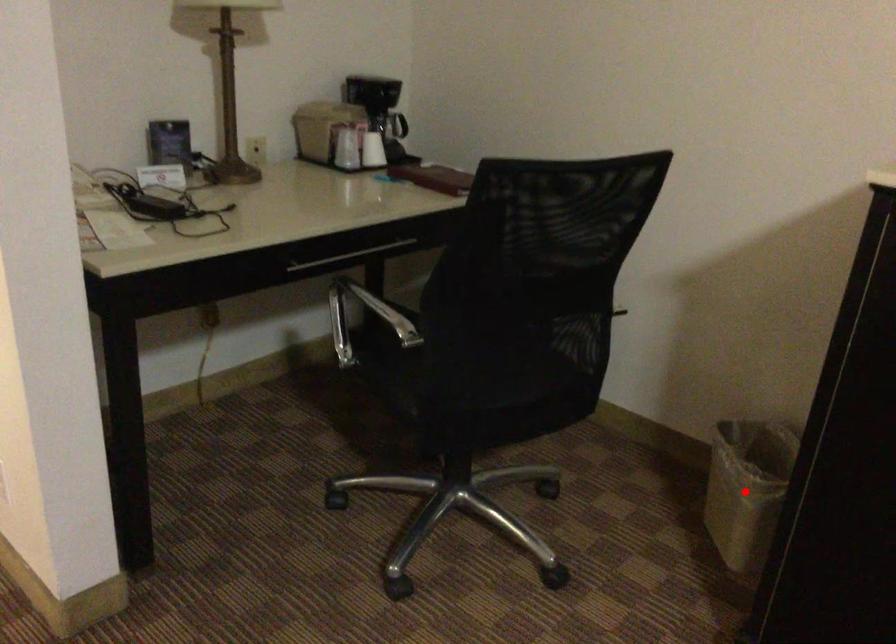
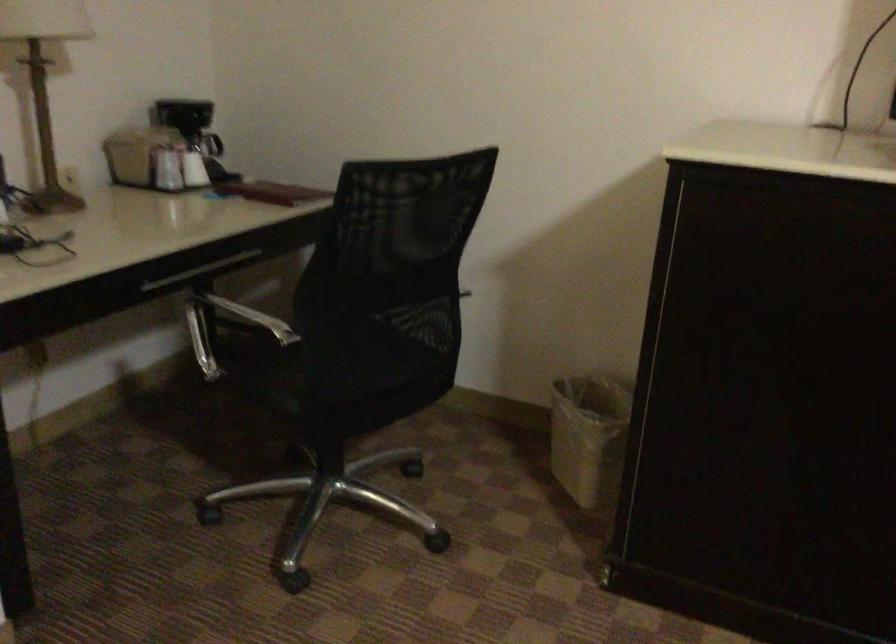
Question: I am providing you with two images of the same scene from different viewpoints. Given a red point in image1, look at the same physical point in image2. Is it:

Choices:
 (A) Closer to the viewpoint
 (B) Farther from the viewpoint

Answer: (B)